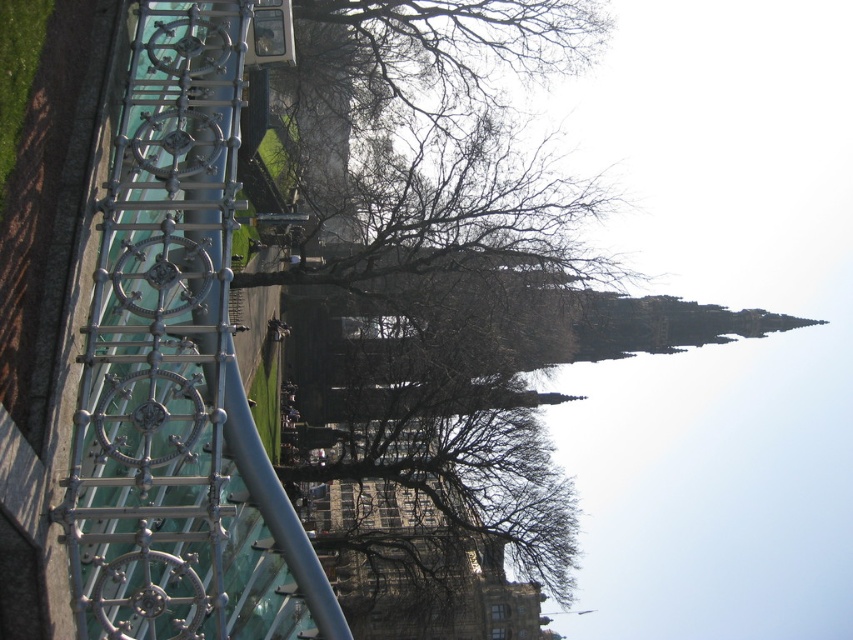
You are designing a safety inspection plan for the park. You need to ensure that the metallic polished rail at left and the brown leafless tree at center are spaced properly. According to the scene description, which object has a narrower width?

The metallic polished rail at left has a lesser width compared to the brown leafless tree at center, so the metallic polished rail at left is narrower.

You are a painter setting up an easel to capture the park scene. You want to ensure that both the metallic polished rail at left and the brown leafless tree at center are visible in your painting. Given their heights, which object will appear taller in your painting?

The brown leafless tree at center appears taller in the painting because the metallic polished rail at left has a lesser height compared to it.